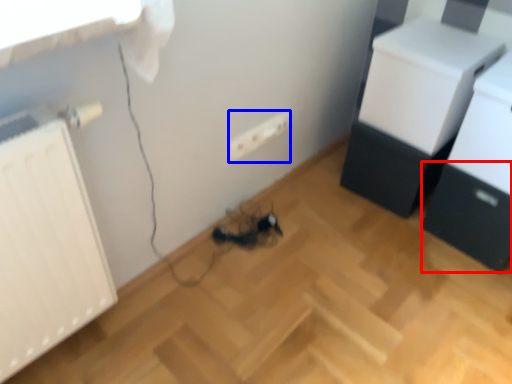
Question: Which of the following is the farthest to the observer, drawer (highlighted by a red box) or electric outlet (highlighted by a blue box)?

Choices:
 (A) drawer
 (B) electric outlet

Answer: (B)